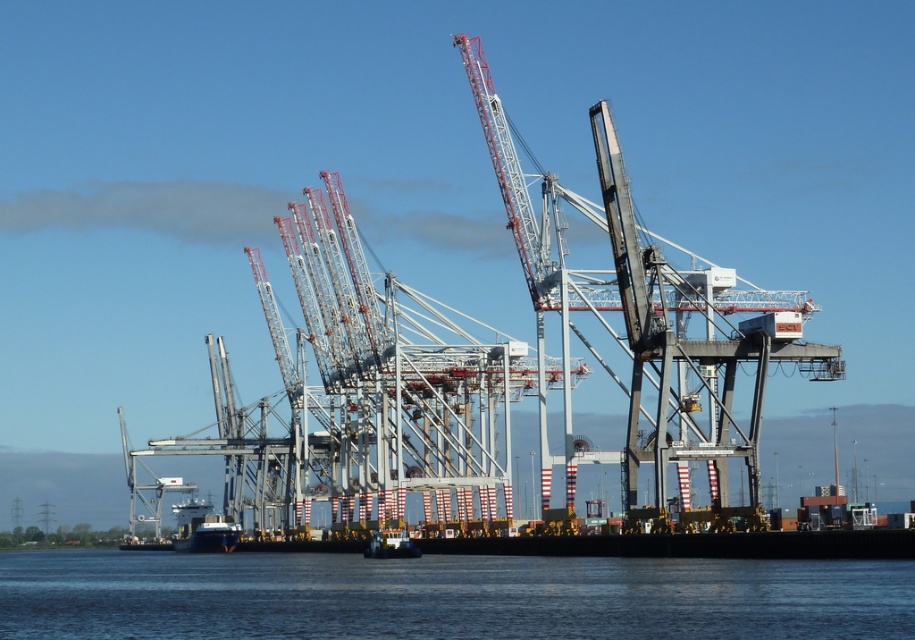
You are standing at the dock and see two points marked in the scene. The first point is at coordinate point(630, 486) and the second is at point(201, 538). Which point is closer to you?

Point(630, 486) is closer to you because it is in front of point(201, 538).

You are a port engineer assessing the layout of the port. You need to determine if the metallic gray crane at center can be moved closer to the black matte boat at lower center without overlapping. Based on their sizes, what do you conclude?

The metallic gray crane at center has a larger width than the black matte boat at lower center. Since the crane is wider, moving it closer may cause overlap unless sufficient space is maintained between them to accommodate both objects.